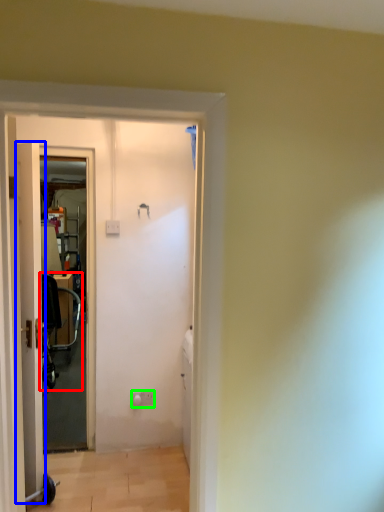
Question: Which is nearer to the baby carriage (highlighted by a red box)? door (highlighted by a blue box) or electric outlet (highlighted by a green box).

Choices:
 (A) door
 (B) electric outlet

Answer: (B)